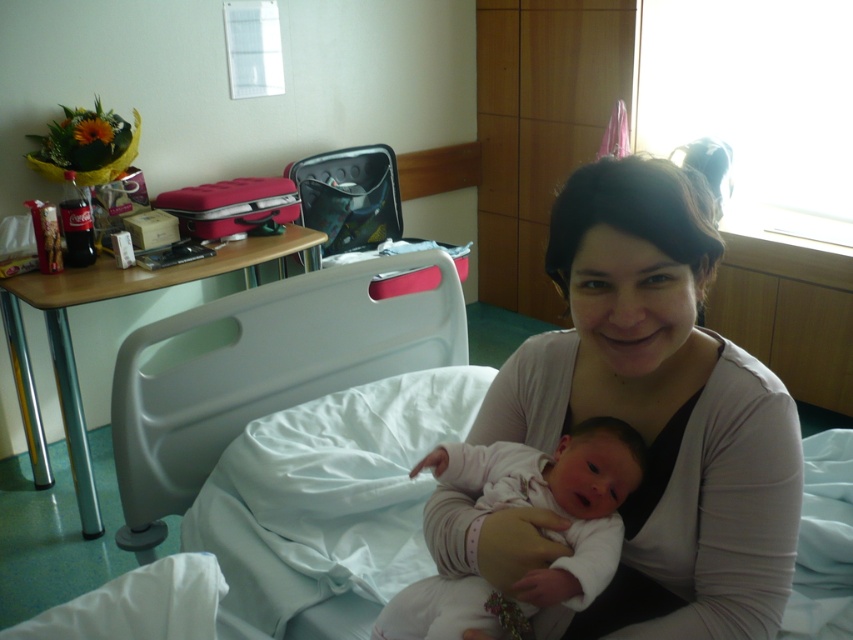
Is point (769, 544) less distant than point (286, 406)?

Yes, point (769, 544) is in front of point (286, 406).

Does smooth white shirt at center appear on the left side of white fabric hospital bed at center?

In fact, smooth white shirt at center is to the right of white fabric hospital bed at center.

Locate an element on the screen. This screenshot has width=853, height=640. smooth white shirt at center is located at coordinates (660, 410).

Is smooth white shirt at center to the left of light pink fabric newborn at center from the viewer's perspective?

No, smooth white shirt at center is not to the left of light pink fabric newborn at center.

Is point (627, 275) positioned behind point (440, 582)?

No, it is in front of (440, 582).

What do you see at coordinates (660, 410) in the screenshot?
I see `smooth white shirt at center` at bounding box center [660, 410].

Where is `smooth white shirt at center`? The image size is (853, 640). smooth white shirt at center is located at coordinates (660, 410).

Which is above, white fabric hospital bed at center or light pink fabric newborn at center?

white fabric hospital bed at center

Measure the distance between white fabric hospital bed at center and light pink fabric newborn at center.

A distance of 77.66 centimeters exists between white fabric hospital bed at center and light pink fabric newborn at center.

Describe the element at coordinates (264, 369) in the screenshot. I see `white fabric hospital bed at center` at that location.

The width and height of the screenshot is (853, 640). Find the location of `white fabric hospital bed at center`. white fabric hospital bed at center is located at coordinates (264, 369).